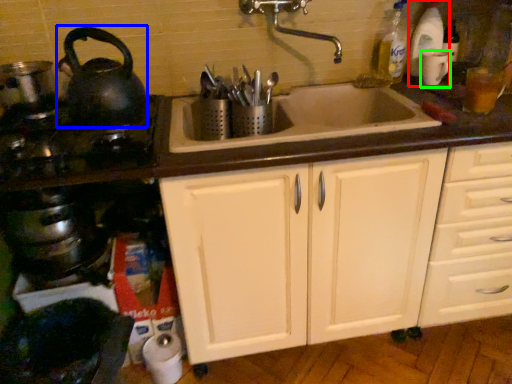
Question: Estimate the real-world distances between objects in this image. Which object is farther from bottle (highlighted by a red box), tea pot (highlighted by a blue box) or appliance (highlighted by a green box)?

Choices:
 (A) tea pot
 (B) appliance

Answer: (A)